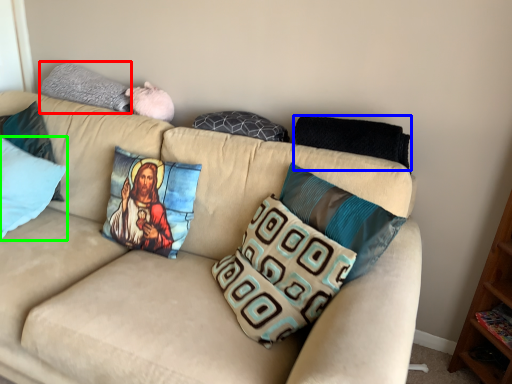
Question: Which is farther away from pillow (highlighted by a red box)? pillow (highlighted by a blue box) or pillow (highlighted by a green box)?

Choices:
 (A) pillow
 (B) pillow

Answer: (A)